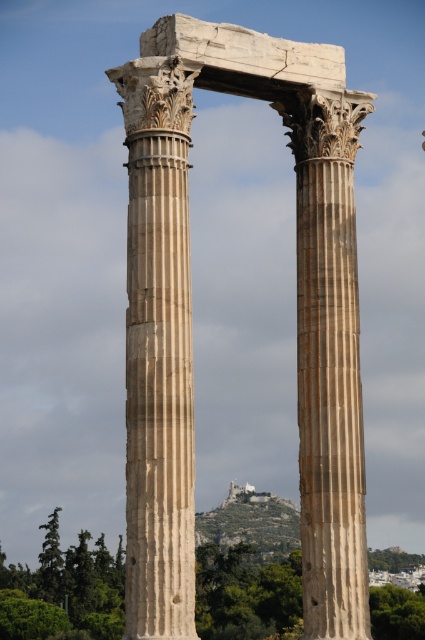
Question: Which point is closer to the camera taking this photo?

Choices:
 (A) (334, 301)
 (B) (334, 406)

Answer: (B)

Question: In this image, where is marble column at center located relative to beige marble column at center?

Choices:
 (A) above
 (B) below

Answer: (B)

Question: Which is nearer to the beige stone columns at center?

Choices:
 (A) beige marble column at center
 (B) marble column at center

Answer: (B)

Question: Can you confirm if marble column at center is positioned above beige marble column at center?

Choices:
 (A) yes
 (B) no

Answer: (B)

Question: Can you confirm if beige stone columns at center is wider than beige marble column at center?

Choices:
 (A) yes
 (B) no

Answer: (A)

Question: Based on their relative distances, which object is farther from the marble column at center?

Choices:
 (A) beige stone columns at center
 (B) beige marble column at center

Answer: (B)